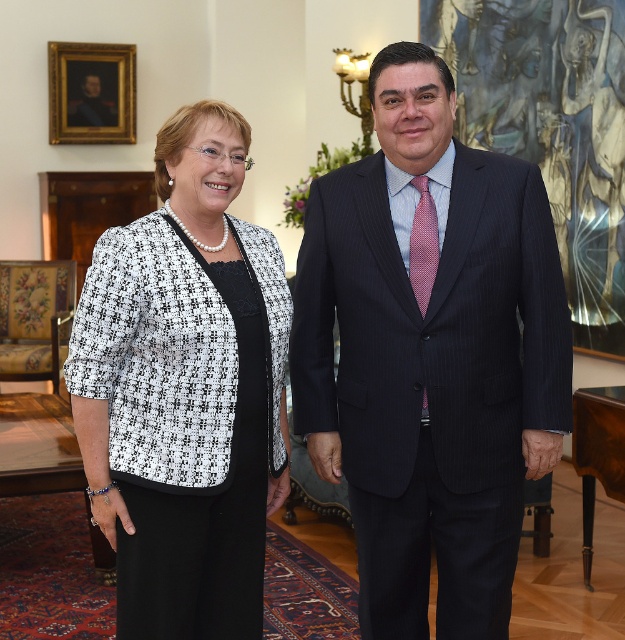
Question: Which point is closer to the camera?

Choices:
 (A) (528, 289)
 (B) (126, 547)

Answer: (B)

Question: Considering the real-world distances, which object is closest to the pinstriped wool suit at center?

Choices:
 (A) goldwooden frame at upper left
 (B) black tweed blazer at center

Answer: (B)

Question: Which point is farther to the camera?

Choices:
 (A) (208, 616)
 (B) (478, 371)

Answer: (A)

Question: Is black tweed blazer at center to the right of goldwooden frame at upper left from the viewer's perspective?

Choices:
 (A) yes
 (B) no

Answer: (A)

Question: Does pinstriped wool suit at center appear over black tweed blazer at center?

Choices:
 (A) yes
 (B) no

Answer: (B)

Question: Can you confirm if black tweed blazer at center is positioned to the left of goldwooden frame at upper left?

Choices:
 (A) yes
 (B) no

Answer: (B)